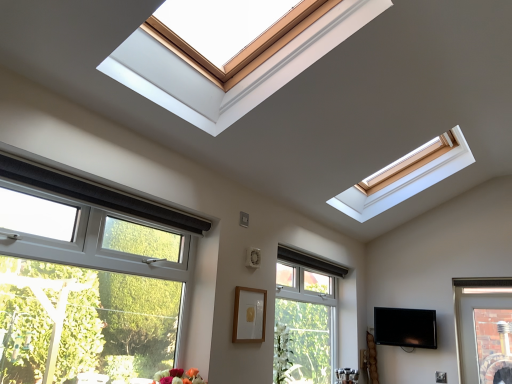
In order to click on white glossy vase at center in this screenshot , I will do `click(283, 355)`.

What do you see at coordinates (283, 355) in the screenshot?
I see `white glossy vase at center` at bounding box center [283, 355].

Identify the location of black glossy tv at lower right. (405, 327).

Relative to clear glass window at center, the first window from the back, is white glossy vase at center in front or behind?

Visually, white glossy vase at center is located in front of clear glass window at center, the first window from the back.

From a real-world perspective, which object stands above the other?

clear glass window at center, the 2th window from the left, from a real-world perspective.

Does point (279, 328) come in front of point (320, 362)?

Yes, it is.

Based on the photo, is white glossy vase at center oriented towards clear glass window at center, which appears as the 1th window when viewed from the right?

No, white glossy vase at center is not aimed at clear glass window at center, which appears as the 1th window when viewed from the right.

Is white plastic window at lower left, which is the 2th window in back-to-front order, oriented towards wooden picture frame at center?

No.

Is white plastic window at lower left, which is the 2th window in back-to-front order, next to wooden picture frame at center and touching it?

No.

The image size is (512, 384). I want to click on window above the wooden picture frame at center (from the image's perspective), so click(87, 279).

Is white plastic window at lower left, the second window viewed from the right, positioned before wooden picture frame at center?

Yes, it is.

Is black glossy tv at lower right oriented away from wooden picture frame at center?

No, wooden picture frame at center is not at the back of black glossy tv at lower right.

Is black glossy tv at lower right not inside wooden picture frame at center?

black glossy tv at lower right is positioned outside wooden picture frame at center.

What's the angular difference between black glossy tv at lower right and wooden picture frame at center's facing directions?

The angle between the facing direction of black glossy tv at lower right and the facing direction of wooden picture frame at center is 81.6 degrees.

Is point (244, 312) farther from camera compared to point (320, 371)?

No, (244, 312) is in front of (320, 371).

Is wooden picture frame at center spatially inside clear glass window at center, the first window from the back, or outside of it?

The correct answer is: outside.

Between wooden picture frame at center and clear glass window at center, which appears as the 1th window when viewed from the right, which one has more height?

Standing taller between the two is clear glass window at center, which appears as the 1th window when viewed from the right.

How different are the orientations of wooden picture frame at center and clear glass window at center, the 2th window from the left, in degrees?

wooden picture frame at center and clear glass window at center, the 2th window from the left, are facing 0.000445 degrees away from each other.

From the image's perspective, who appears lower, clear glass window at center, placed as the second window when sorted from front to back, or wooden picture frame at center?

From the image's view, clear glass window at center, placed as the second window when sorted from front to back, is below.

You are a GUI agent. You are given a task and a screenshot of the screen. Output one action in this format:
    pyautogui.click(x=<x>, y=<y>)
    Task: Click on the picture frame that appears above the clear glass window at center, placed as the second window when sorted from front to back (from the image's perspective)
    
    Given the screenshot: What is the action you would take?
    pyautogui.click(x=249, y=315)

Who is taller, clear glass window at center, which appears as the 1th window when viewed from the right, or wooden picture frame at center?

clear glass window at center, which appears as the 1th window when viewed from the right.

Is clear glass window at center, placed as the second window when sorted from front to back, at the left side of wooden picture frame at center?

No.

How many degrees apart are the facing directions of white glossy vase at center and wooden picture frame at center?

1.86 degrees.

From the image's perspective, between white glossy vase at center and wooden picture frame at center, which one is located above?

From the image's view, wooden picture frame at center is above.

Which is behind, point (276, 331) or point (263, 318)?

The point (276, 331) is more distant.

Is white glossy vase at center smaller than wooden picture frame at center?

No.

From a real-world perspective, which is physically below, clear glass window at center, placed as the second window when sorted from front to back, or black glossy tv at lower right?

From a 3D spatial view, clear glass window at center, placed as the second window when sorted from front to back, is below.

From the image's perspective, which one is positioned higher, clear glass window at center, which appears as the 1th window when viewed from the right, or black glossy tv at lower right?

clear glass window at center, which appears as the 1th window when viewed from the right, appears higher in the image.

Is clear glass window at center, which appears as the 1th window when viewed from the right, spatially inside black glossy tv at lower right, or outside of it?

clear glass window at center, which appears as the 1th window when viewed from the right, is not inside black glossy tv at lower right, it's outside.

There is a black glossy tv at lower right. What are the coordinates of `the 1st window above it (from the image's perspective)` in the screenshot? It's located at (305, 318).

At what (x,y) coordinates should I click in order to perform the action: click on window that is below the white glossy vase at center (from the image's perspective). Please return your answer as a coordinate pair (x, y). This screenshot has height=384, width=512. Looking at the image, I should click on (305, 318).

Where is `window to the left of wooden picture frame at center`? The height and width of the screenshot is (384, 512). window to the left of wooden picture frame at center is located at coordinates (87, 279).

Considering their positions, is white glossy vase at center positioned closer to white plastic window at lower left, the first window in the front-to-back sequence, than black glossy tv at lower right?

white glossy vase at center.

Looking at the image, which one is located further to white glossy vase at center, white plastic window at lower left, the first window in the front-to-back sequence, or clear glass window at center, placed as the second window when sorted from front to back?

white plastic window at lower left, the first window in the front-to-back sequence, is positioned further to the anchor white glossy vase at center.

Looking at the image, which one is located closer to white plastic window at lower left, which is the 2th window in back-to-front order, wooden picture frame at center or black glossy tv at lower right?

wooden picture frame at center is positioned closer to the anchor white plastic window at lower left, which is the 2th window in back-to-front order.

Considering their positions, is clear glass window at center, placed as the second window when sorted from front to back, positioned further to wooden picture frame at center than white glossy vase at center?

Based on the image, clear glass window at center, placed as the second window when sorted from front to back, appears to be further to wooden picture frame at center.

Looking at the image, which one is located closer to clear glass window at center, the first window from the back, white plastic window at lower left, which is the 2th window in back-to-front order, or wooden picture frame at center?

Based on the image, wooden picture frame at center appears to be nearer to clear glass window at center, the first window from the back.

Considering their positions, is clear glass window at center, which appears as the 1th window when viewed from the right, positioned further to white glossy vase at center than white plastic window at lower left, the second window viewed from the right?

Based on the image, white plastic window at lower left, the second window viewed from the right, appears to be further to white glossy vase at center.

Estimate the real-world distances between objects in this image. Which object is closer to black glossy tv at lower right, wooden picture frame at center or clear glass window at center, placed as the second window when sorted from front to back?

Based on the image, clear glass window at center, placed as the second window when sorted from front to back, appears to be nearer to black glossy tv at lower right.

Considering their positions, is black glossy tv at lower right positioned closer to wooden picture frame at center than white plastic window at lower left, which ranks as the first window in left-to-right order?

white plastic window at lower left, which ranks as the first window in left-to-right order, is positioned closer to the anchor wooden picture frame at center.

Locate an element on the screen. This screenshot has height=384, width=512. plant between wooden picture frame at center and black glossy tv at lower right from left to right is located at coordinates (283, 355).

I want to click on window situated between white glossy vase at center and black glossy tv at lower right from left to right, so click(x=305, y=318).

Find the location of a particular element. The image size is (512, 384). plant between white plastic window at lower left, which is the 2th window in back-to-front order, and clear glass window at center, which appears as the 1th window when viewed from the right, from front to back is located at coordinates (283, 355).

You are a GUI agent. You are given a task and a screenshot of the screen. Output one action in this format:
    pyautogui.click(x=<x>, y=<y>)
    Task: Click on the picture frame between white plastic window at lower left, which ranks as the first window in left-to-right order, and white glossy vase at center in the front-back direction
    The width and height of the screenshot is (512, 384).
    Given the screenshot: What is the action you would take?
    [x=249, y=315]